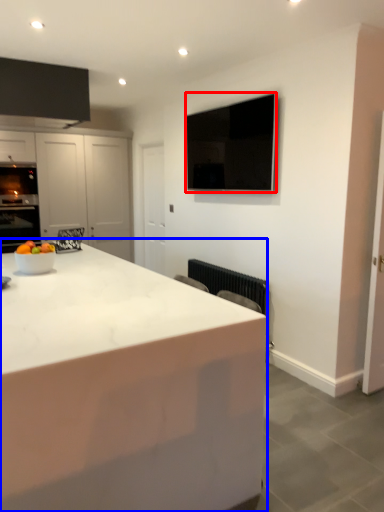
Question: Which object appears closest to the camera in this image, appliance (highlighted by a red box) or countertop (highlighted by a blue box)?

Choices:
 (A) appliance
 (B) countertop

Answer: (B)